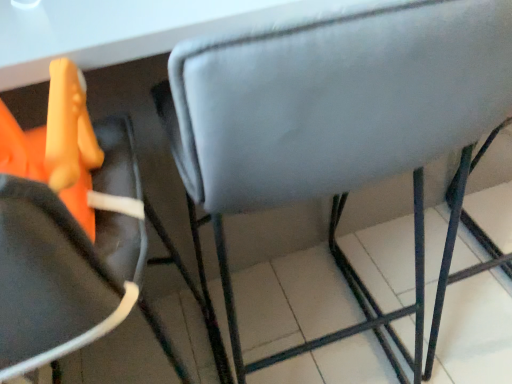
The width and height of the screenshot is (512, 384). Describe the element at coordinates (338, 127) in the screenshot. I see `velvet-like gray chair at center, the 2th chair viewed from the left` at that location.

Locate an element on the screen. Image resolution: width=512 pixels, height=384 pixels. velvet-like gray chair at center, which is the 1th chair from right to left is located at coordinates (338, 127).

Where is `matte gray cushion at center, acting as the 2th chair starting from the right`? This screenshot has height=384, width=512. matte gray cushion at center, acting as the 2th chair starting from the right is located at coordinates (69, 232).

This screenshot has width=512, height=384. Describe the element at coordinates (69, 232) in the screenshot. I see `matte gray cushion at center, positioned as the 1th chair in left-to-right order` at that location.

The image size is (512, 384). I want to click on velvet-like gray chair at center, the 2th chair viewed from the left, so click(x=338, y=127).

Which object is positioned more to the left, matte gray cushion at center, acting as the 2th chair starting from the right, or velvet-like gray chair at center, which is the 1th chair from right to left?

From the viewer's perspective, matte gray cushion at center, acting as the 2th chair starting from the right, appears more on the left side.

Between matte gray cushion at center, positioned as the 1th chair in left-to-right order, and velvet-like gray chair at center, which is the 1th chair from right to left, which one is positioned in front?

matte gray cushion at center, positioned as the 1th chair in left-to-right order, is in front.

Is point (90, 192) more distant than point (284, 71)?

Yes, it is behind point (284, 71).

From the image's perspective, which is above, matte gray cushion at center, acting as the 2th chair starting from the right, or velvet-like gray chair at center, the 2th chair viewed from the left?

From the image's view, velvet-like gray chair at center, the 2th chair viewed from the left, is above.

From a real-world perspective, is matte gray cushion at center, positioned as the 1th chair in left-to-right order, below velvet-like gray chair at center, which is the 1th chair from right to left?

Yes, from a real-world perspective, matte gray cushion at center, positioned as the 1th chair in left-to-right order, is under velvet-like gray chair at center, which is the 1th chair from right to left.

Does matte gray cushion at center, positioned as the 1th chair in left-to-right order, have a lesser width compared to velvet-like gray chair at center, the 2th chair viewed from the left?

No.

Between matte gray cushion at center, acting as the 2th chair starting from the right, and velvet-like gray chair at center, the 2th chair viewed from the left, which one has less height?

Standing shorter between the two is velvet-like gray chair at center, the 2th chair viewed from the left.

Considering the sizes of objects matte gray cushion at center, acting as the 2th chair starting from the right, and velvet-like gray chair at center, which is the 1th chair from right to left, in the image provided, who is smaller, matte gray cushion at center, acting as the 2th chair starting from the right, or velvet-like gray chair at center, which is the 1th chair from right to left,?

velvet-like gray chair at center, which is the 1th chair from right to left, is smaller.

Is velvet-like gray chair at center, which is the 1th chair from right to left, a part of matte gray cushion at center, positioned as the 1th chair in left-to-right order?

No, velvet-like gray chair at center, which is the 1th chair from right to left, is not a part of matte gray cushion at center, positioned as the 1th chair in left-to-right order.

Is matte gray cushion at center, positioned as the 1th chair in left-to-right order, directly adjacent to velvet-like gray chair at center, the 2th chair viewed from the left?

matte gray cushion at center, positioned as the 1th chair in left-to-right order, is not next to velvet-like gray chair at center, the 2th chair viewed from the left, and they're not touching.

Is matte gray cushion at center, acting as the 2th chair starting from the right, aimed at velvet-like gray chair at center, which is the 1th chair from right to left?

No, matte gray cushion at center, acting as the 2th chair starting from the right, is not turned towards velvet-like gray chair at center, which is the 1th chair from right to left.

At what (x,y) coordinates should I click in order to perform the action: click on chair located underneath the velvet-like gray chair at center, which is the 1th chair from right to left (from a real-world perspective). Please return your answer as a coordinate pair (x, y). The image size is (512, 384). Looking at the image, I should click on (69, 232).

Between velvet-like gray chair at center, the 2th chair viewed from the left, and matte gray cushion at center, acting as the 2th chair starting from the right, which one appears on the right side from the viewer's perspective?

Positioned to the right is velvet-like gray chair at center, the 2th chair viewed from the left.

Who is more distant, velvet-like gray chair at center, the 2th chair viewed from the left, or matte gray cushion at center, positioned as the 1th chair in left-to-right order?

velvet-like gray chair at center, the 2th chair viewed from the left, is further away from the camera.

Does point (396, 48) come in front of point (101, 313)?

Yes, point (396, 48) is closer to viewer.

From the image's perspective, between velvet-like gray chair at center, the 2th chair viewed from the left, and matte gray cushion at center, acting as the 2th chair starting from the right, who is located below?

matte gray cushion at center, acting as the 2th chair starting from the right, from the image's perspective.

From a real-world perspective, is velvet-like gray chair at center, the 2th chair viewed from the left, located beneath matte gray cushion at center, acting as the 2th chair starting from the right?

No, from a real-world perspective, velvet-like gray chair at center, the 2th chair viewed from the left, is not below matte gray cushion at center, acting as the 2th chair starting from the right.

Is velvet-like gray chair at center, which is the 1th chair from right to left, wider than matte gray cushion at center, acting as the 2th chair starting from the right?

In fact, velvet-like gray chair at center, which is the 1th chair from right to left, might be narrower than matte gray cushion at center, acting as the 2th chair starting from the right.

Between velvet-like gray chair at center, the 2th chair viewed from the left, and matte gray cushion at center, acting as the 2th chair starting from the right, which one has more height?

matte gray cushion at center, acting as the 2th chair starting from the right.

Is velvet-like gray chair at center, which is the 1th chair from right to left, bigger than matte gray cushion at center, acting as the 2th chair starting from the right?

Actually, velvet-like gray chair at center, which is the 1th chair from right to left, might be smaller than matte gray cushion at center, acting as the 2th chair starting from the right.

Could matte gray cushion at center, positioned as the 1th chair in left-to-right order, be considered to be inside velvet-like gray chair at center, the 2th chair viewed from the left?

No, matte gray cushion at center, positioned as the 1th chair in left-to-right order, is not inside velvet-like gray chair at center, the 2th chair viewed from the left.

Based on the photo, would you say velvet-like gray chair at center, which is the 1th chair from right to left, is a long distance from matte gray cushion at center, positioned as the 1th chair in left-to-right order?

Actually, velvet-like gray chair at center, which is the 1th chair from right to left, and matte gray cushion at center, positioned as the 1th chair in left-to-right order, are a little close together.

Is velvet-like gray chair at center, which is the 1th chair from right to left, oriented towards matte gray cushion at center, positioned as the 1th chair in left-to-right order?

No.

Consider the image. How far apart are velvet-like gray chair at center, which is the 1th chair from right to left, and matte gray cushion at center, positioned as the 1th chair in left-to-right order?

velvet-like gray chair at center, which is the 1th chair from right to left, is 27.02 centimeters from matte gray cushion at center, positioned as the 1th chair in left-to-right order.

You are a GUI agent. You are given a task and a screenshot of the screen. Output one action in this format:
    pyautogui.click(x=<x>, y=<y>)
    Task: Click on the chair on the left of velvet-like gray chair at center, the 2th chair viewed from the left
    
    Given the screenshot: What is the action you would take?
    pyautogui.click(x=69, y=232)

Find the location of a particular element. The height and width of the screenshot is (384, 512). chair in front of the velvet-like gray chair at center, the 2th chair viewed from the left is located at coordinates (69, 232).

Where is `chair on the right of the matte gray cushion at center, acting as the 2th chair starting from the right`? The image size is (512, 384). chair on the right of the matte gray cushion at center, acting as the 2th chair starting from the right is located at coordinates (338, 127).